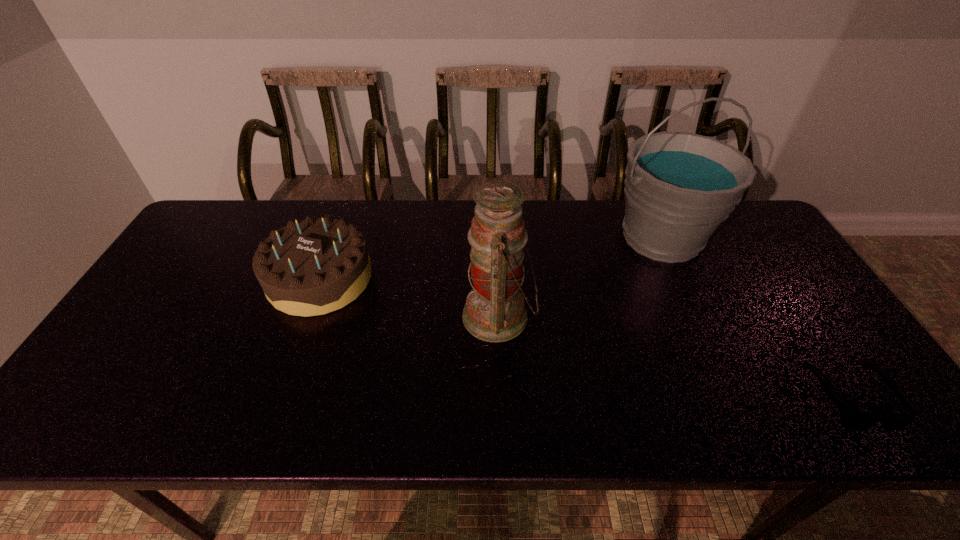
Image resolution: width=960 pixels, height=540 pixels. What are the coordinates of `the second object from right to left` in the screenshot? It's located at (679, 186).

Where is `oil lamp`? The image size is (960, 540). oil lamp is located at coordinates (494, 311).

Where is `birthday cake`? This screenshot has width=960, height=540. birthday cake is located at coordinates (316, 266).

What are the coordinates of `the second shortest object` in the screenshot? It's located at (316, 266).

You are a GUI agent. You are given a task and a screenshot of the screen. Output one action in this format:
    pyautogui.click(x=<x>, y=<y>)
    Task: Click on the sunglasses
    
    Given the screenshot: What is the action you would take?
    pyautogui.click(x=855, y=421)

Locate an element on the screen. The image size is (960, 540). the nearest object is located at coordinates (855, 421).

This screenshot has height=540, width=960. I want to click on vacant space located on the front of the third object from left to right, so click(695, 312).

This screenshot has height=540, width=960. In order to click on free point located on the right of the second object from left to right in this screenshot , I will do `click(600, 316)`.

This screenshot has height=540, width=960. What are the coordinates of `free space located 0.220m on the front-facing side of the second shortest object` in the screenshot? It's located at (277, 394).

Where is `bucket that is at the far edge`? Image resolution: width=960 pixels, height=540 pixels. bucket that is at the far edge is located at coordinates (679, 186).